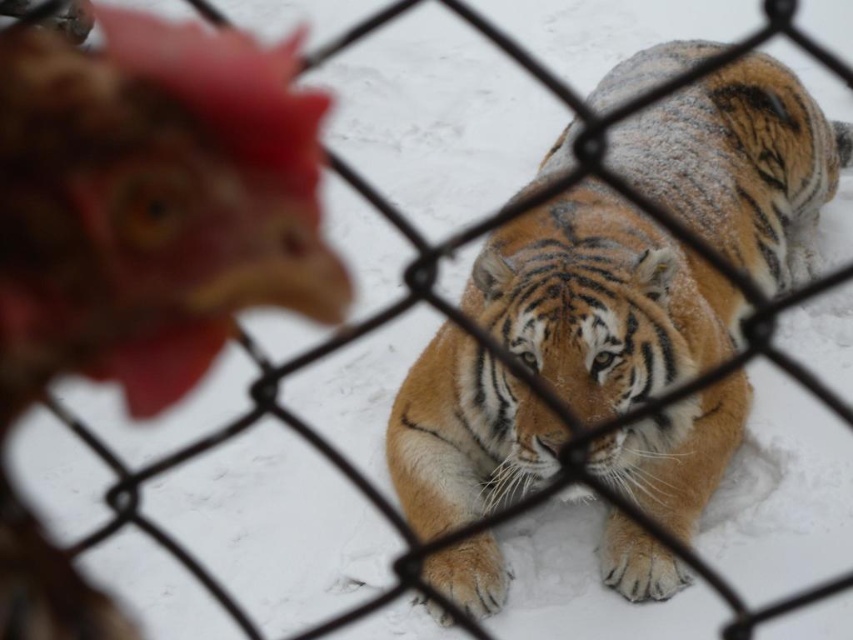
Question: Can you confirm if orange fur tiger at center is positioned above brown feathered chicken at left?

Choices:
 (A) yes
 (B) no

Answer: (B)

Question: Which point appears farthest from the camera in this image?

Choices:
 (A) (415, 513)
 (B) (109, 42)

Answer: (B)

Question: From the image, what is the correct spatial relationship of orange fur tiger at center in relation to brown feathered chicken at left?

Choices:
 (A) right
 (B) left

Answer: (A)

Question: Is orange fur tiger at center positioned in front of brown feathered chicken at left?

Choices:
 (A) no
 (B) yes

Answer: (B)

Question: Which point is farther to the camera?

Choices:
 (A) brown feathered chicken at left
 (B) orange fur tiger at center

Answer: (A)